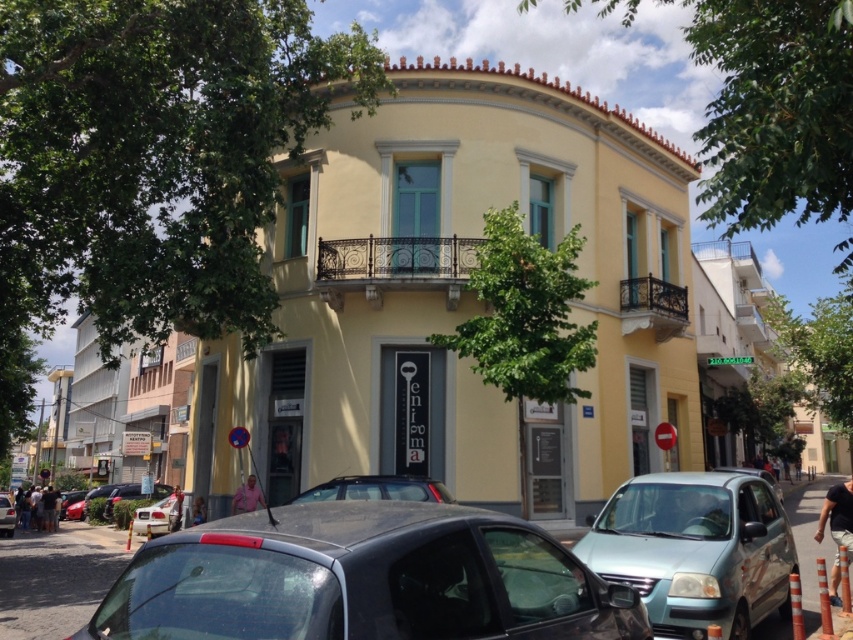
Question: Which of the following is the farthest from the observer?

Choices:
 (A) (724, 602)
 (B) (164, 532)

Answer: (B)

Question: Is shiny black car at center above light blue metallic car at lower right?

Choices:
 (A) yes
 (B) no

Answer: (A)

Question: Which object appears closest to the camera in this image?

Choices:
 (A) light blue metallic car at lower right
 (B) matte black car at center
 (C) matte black car at lower left
 (D) shiny black car at center

Answer: (D)

Question: Can you confirm if shiny black car at center is thinner than matte black car at lower left?

Choices:
 (A) yes
 (B) no

Answer: (B)

Question: Can you confirm if silver metallic car at lower left is positioned above matte black car at lower left?

Choices:
 (A) yes
 (B) no

Answer: (A)

Question: Which point is farther to the camera?

Choices:
 (A) pos(4,515)
 (B) pos(369,474)
 (C) pos(164,512)
 (D) pos(683,534)

Answer: (A)